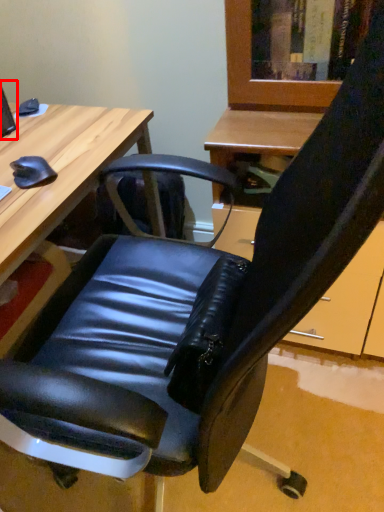
Question: From the image's perspective, what is the correct spatial relationship of computer monitor (annotated by the red box) in relation to desk?

Choices:
 (A) below
 (B) above

Answer: (B)